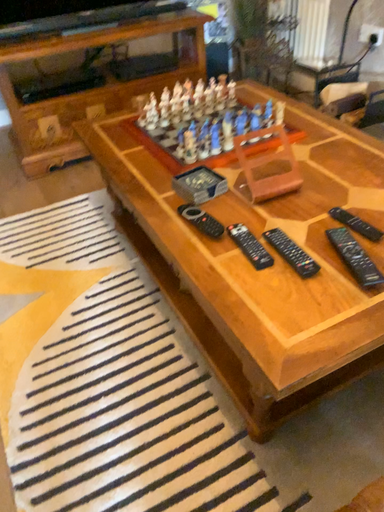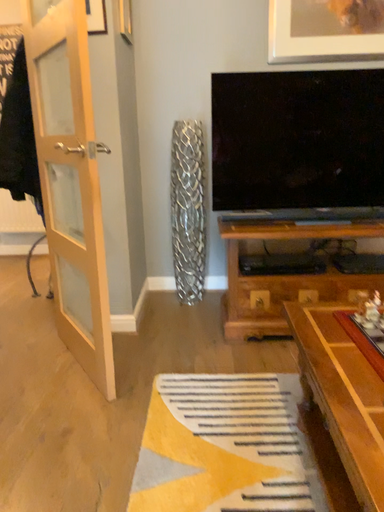
Question: How did the camera likely rotate when shooting the video?

Choices:
 (A) rotated upward
 (B) rotated downward

Answer: (A)